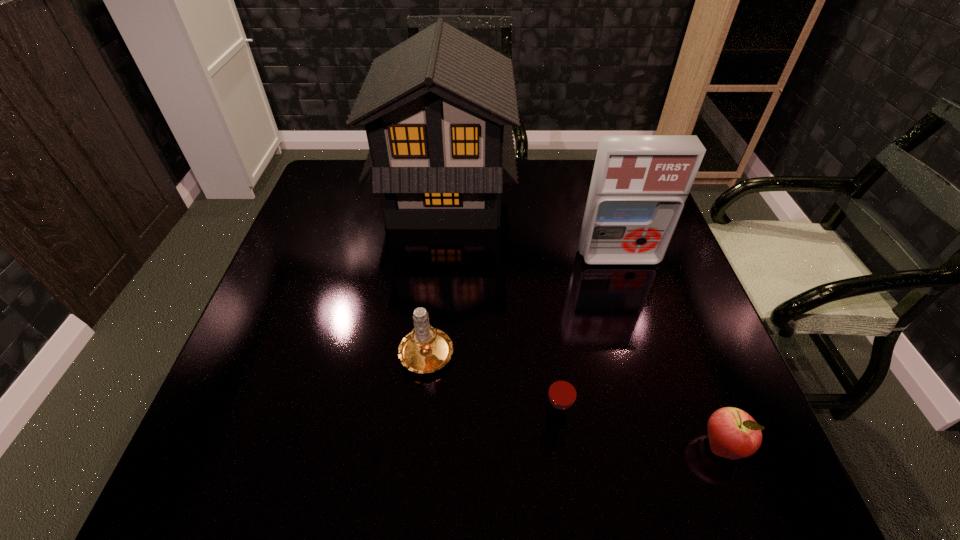
Where is `vacant space at the left edge of the desktop`? This screenshot has width=960, height=540. vacant space at the left edge of the desktop is located at coordinates (307, 303).

In the image, there is a desktop. At what (x,y) coordinates should I click in order to perform the action: click on blank space at the right edge. Please return your answer as a coordinate pair (x, y). This screenshot has height=540, width=960. Looking at the image, I should click on (721, 359).

Locate an element on the screen. The height and width of the screenshot is (540, 960). vacant space at the far left corner of the desktop is located at coordinates (345, 164).

In the image, there is a desktop. Where is `vacant space at the near left corner`? vacant space at the near left corner is located at coordinates (274, 468).

Where is `free region at the far right corner of the desktop`? The image size is (960, 540). free region at the far right corner of the desktop is located at coordinates (588, 172).

Image resolution: width=960 pixels, height=540 pixels. Find the location of `unoccupied area between the glass and the third shortest object`. unoccupied area between the glass and the third shortest object is located at coordinates (492, 384).

Locate an element on the screen. The height and width of the screenshot is (540, 960). free space between the farthest object and the candle is located at coordinates (436, 272).

Locate an element on the screen. This screenshot has height=540, width=960. unoccupied position between the dollhouse and the glass is located at coordinates (500, 307).

Locate an element on the screen. The image size is (960, 540). vacant space that's between the farthest object and the fourth nearest object is located at coordinates (532, 226).

I want to click on vacant space that is in between the third farthest object and the third object from left to right, so click(x=492, y=384).